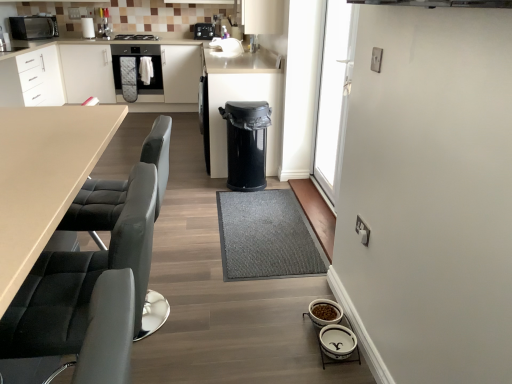
Question: Is satin black oven at center a part of black plastic trash can at center?

Choices:
 (A) no
 (B) yes

Answer: (A)

Question: Considering the relative positions of black plastic trash can at center and satin black oven at center in the image provided, is black plastic trash can at center to the right of satin black oven at center from the viewer's perspective?

Choices:
 (A) no
 (B) yes

Answer: (B)

Question: From a real-world perspective, is black plastic trash can at center physically above satin black oven at center?

Choices:
 (A) no
 (B) yes

Answer: (A)

Question: From the image's perspective, does black plastic trash can at center appear lower than satin black oven at center?

Choices:
 (A) yes
 (B) no

Answer: (A)

Question: Does black plastic trash can at center have a lesser width compared to satin black oven at center?

Choices:
 (A) yes
 (B) no

Answer: (A)

Question: From a real-world perspective, is transparent glass door at upper right physically located above or below gray textured mat at center?

Choices:
 (A) below
 (B) above

Answer: (B)

Question: From the image's perspective, is transparent glass door at upper right positioned above or below gray textured mat at center?

Choices:
 (A) above
 (B) below

Answer: (A)

Question: Considering the positions of transparent glass door at upper right and gray textured mat at center in the image, is transparent glass door at upper right taller or shorter than gray textured mat at center?

Choices:
 (A) tall
 (B) short

Answer: (A)

Question: Is transparent glass door at upper right situated inside gray textured mat at center or outside?

Choices:
 (A) outside
 (B) inside

Answer: (A)

Question: From the image's perspective, is black leather swivel chair at left above or below matte white cabinetry at left?

Choices:
 (A) above
 (B) below

Answer: (B)

Question: Relative to matte white cabinetry at left, is black leather swivel chair at left in front or behind?

Choices:
 (A) front
 (B) behind

Answer: (A)

Question: Based on their positions, is black leather swivel chair at left located to the left or right of matte white cabinetry at left?

Choices:
 (A) right
 (B) left

Answer: (A)

Question: From their relative heights in the image, would you say black leather swivel chair at left is taller or shorter than matte white cabinetry at left?

Choices:
 (A) short
 (B) tall

Answer: (A)

Question: From the image's perspective, is white glossy pet bowls at lower right, placed as the first appliance when sorted from front to back, positioned above or below black leather chair at left?

Choices:
 (A) above
 (B) below

Answer: (B)

Question: Considering the positions of white glossy pet bowls at lower right, which is the third appliance from top to bottom, and black leather chair at left in the image, is white glossy pet bowls at lower right, which is the third appliance from top to bottom, wider or thinner than black leather chair at left?

Choices:
 (A) wide
 (B) thin

Answer: (B)